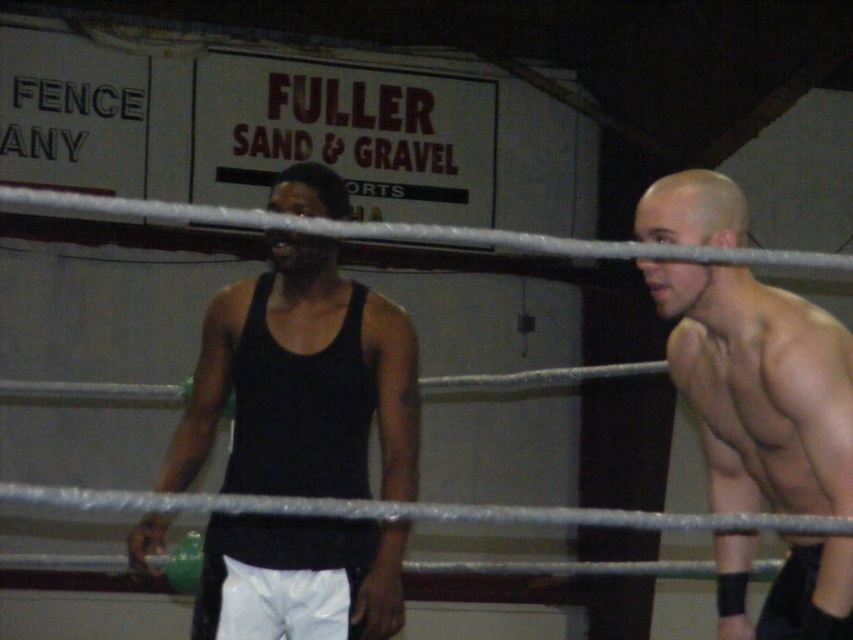
You are standing at the center of the wrestling ring and want to move towards the wall with the sponsor signs. There are two points marked on the wall at coordinates point [263,438] and point [811,467]. Which point should you walk towards if you want to reach the one that is closer to the wrestling ring entrance?

Point [263,438] is behind point [811,467], so the closer point to the wrestling ring entrance would be point [811,467].

Based on the scene, if you were to place a small sticker on the black matte tank top at center and another sticker on the muscular skin at right, which sticker would be placed higher?

The sticker on the black matte tank top at center would be placed higher since it has a greater height compared to the muscular skin at right.

Based on the photo, you are a photographer positioned at the entrance of the wrestling ring. You need to take a photo of both the black matte tank top at center and the muscular skin at right. Based on their positions, which object should you focus on first if you want to capture both in a single frame without moving the camera?

The black matte tank top at center is to the left of muscular skin at right, so you should focus on the black matte tank top at center first to ensure both are in frame without moving the camera.